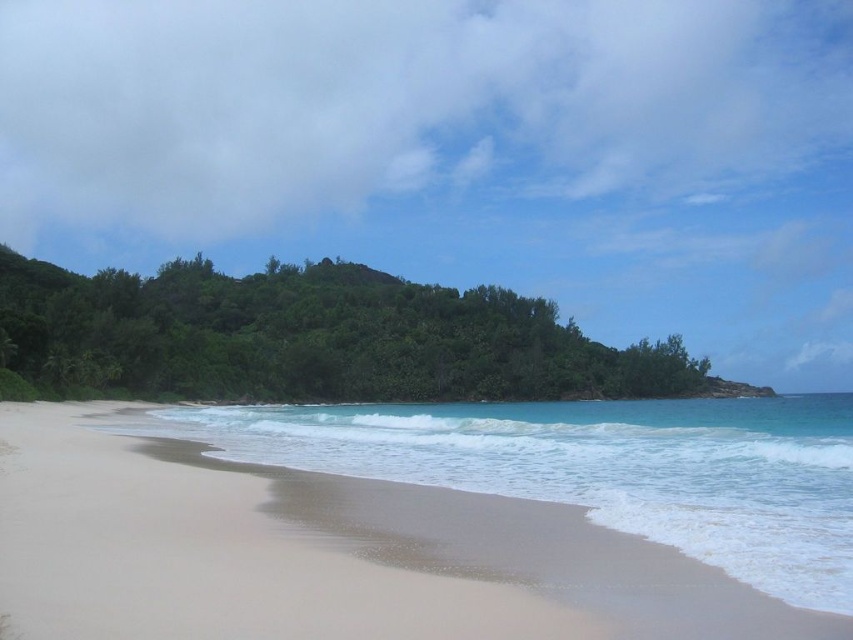
You are standing at the beach and want to reach a specific point marked as point (173, 323). The distance from where you are standing to that point is 128.46 meters. If you walk towards it at a speed of 1.5 meters per second, how many seconds will it take you to reach the point?

The distance between you and point (173, 323) is 128.46 meters. At a walking speed of 1.5 meters per second, it will take approximately 85.64 seconds to reach the point. This is calculated by dividing the distance by the speed.

You are standing on the beach and want to take a photo of both the green leafy island at center and the clear blue water at lower center. Which object should you zoom in on first to ensure both are in frame?

You should zoom in on the clear blue water at lower center first because the green leafy island at center is much taller, so adjusting focus on the closer object ensures both are captured in the frame.

You are standing on the beach and want to take a photo of the green leafy island at center and the clear blue water at lower center. Which object should you frame first in your camera to ensure both are in the shot?

You should frame the green leafy island at center first because it is positioned on the left side of the clear blue water at lower center, so placing it first ensures both objects are included in the photo.